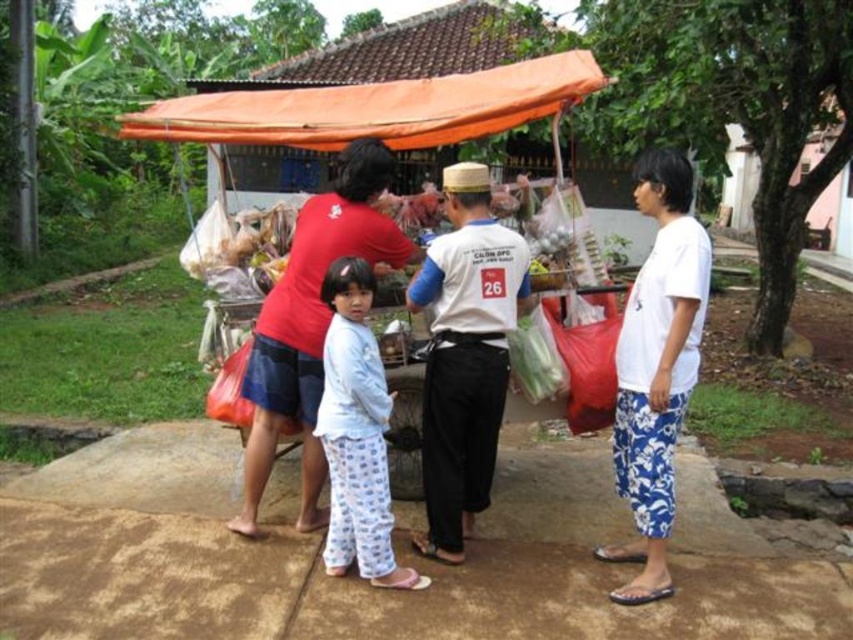
Does point (671, 275) come farther from viewer compared to point (329, 200)?

That is False.

Does point (444, 420) come in front of point (305, 340)?

Yes, it is.

Is point (457, 180) closer to camera compared to point (312, 323)?

Yes, it is.

The image size is (853, 640). In order to click on light blue pajama pants at center in this screenshot , I will do `click(657, 365)`.

Does light blue pajama pants at center appear under white cotton shirt at center?

Indeed, light blue pajama pants at center is positioned under white cotton shirt at center.

Which of these two, light blue pajama pants at center or white cotton shirt at center, stands taller?

light blue pajama pants at center

Between point (468, 461) and point (467, 444), which one is positioned behind?

Positioned behind is point (468, 461).

Find the location of a particular element. This screenshot has width=853, height=640. light blue pajama pants at center is located at coordinates (657, 365).

Between point (434, 376) and point (373, 572), which one is positioned behind?

Positioned behind is point (434, 376).

Can you confirm if white cotton shirt at center is bigger than white cotton pajamas at center?

Yes, white cotton shirt at center is bigger than white cotton pajamas at center.

Is point (445, 320) closer to viewer compared to point (366, 308)?

No, it is not.

Where is `white cotton shirt at center`? This screenshot has width=853, height=640. white cotton shirt at center is located at coordinates (465, 355).